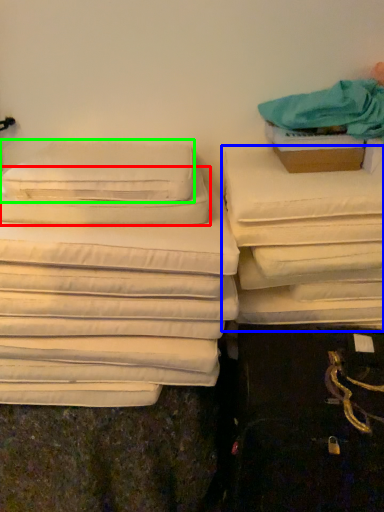
Question: Which object is positioned closest to pillow (highlighted by a red box)? Select from furniture (highlighted by a blue box) and pillow (highlighted by a green box).

Choices:
 (A) furniture
 (B) pillow

Answer: (B)